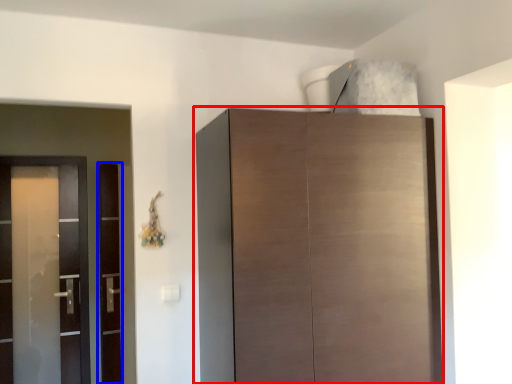
Question: Which object is closer to the camera taking this photo, cupboard (highlighted by a red box) or screen door (highlighted by a blue box)?

Choices:
 (A) cupboard
 (B) screen door

Answer: (A)